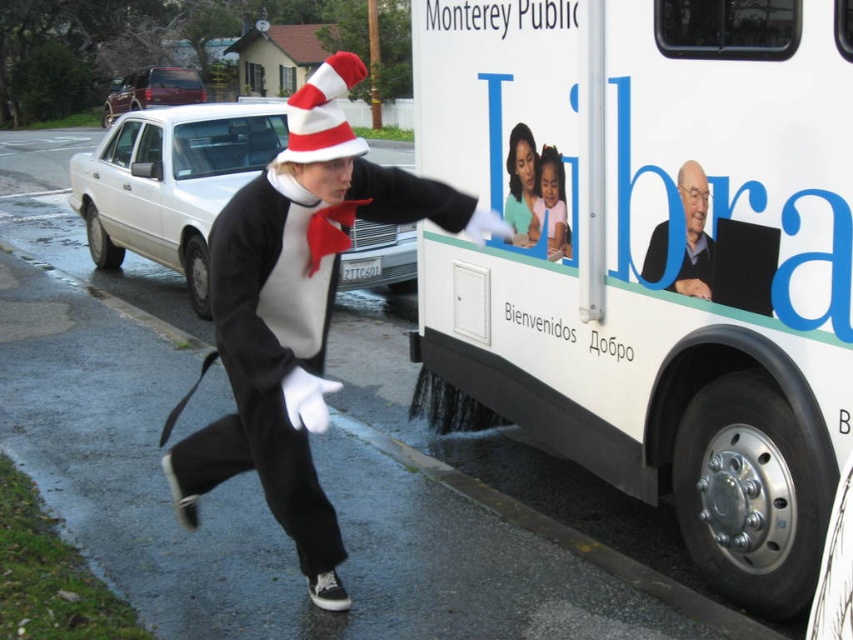
Question: Considering the real-world distances, which object is farthest from the matte black costume at center?

Choices:
 (A) white matte bus at right
 (B) gray hair man at upper right
 (C) red striped fabric hat at center

Answer: (C)

Question: Does white matte bus at right appear under pastel pink fabric at center?

Choices:
 (A) no
 (B) yes

Answer: (B)

Question: Estimate the real-world distances between objects in this image. Which object is closer to the gray hair man at upper right?

Choices:
 (A) red striped fabric hat at center
 (B) matte black costume at center
 (C) pastel pink fabric at center

Answer: (C)

Question: Among these objects, which one is nearest to the camera?

Choices:
 (A) smooth skin woman at upper center
 (B) matte black costume at center
 (C) red striped fabric hat at center

Answer: (B)

Question: Is gray hair man at upper right smaller than pastel pink fabric at center?

Choices:
 (A) no
 (B) yes

Answer: (A)

Question: Is gray hair man at upper right positioned in front of pastel pink fabric at center?

Choices:
 (A) yes
 (B) no

Answer: (A)